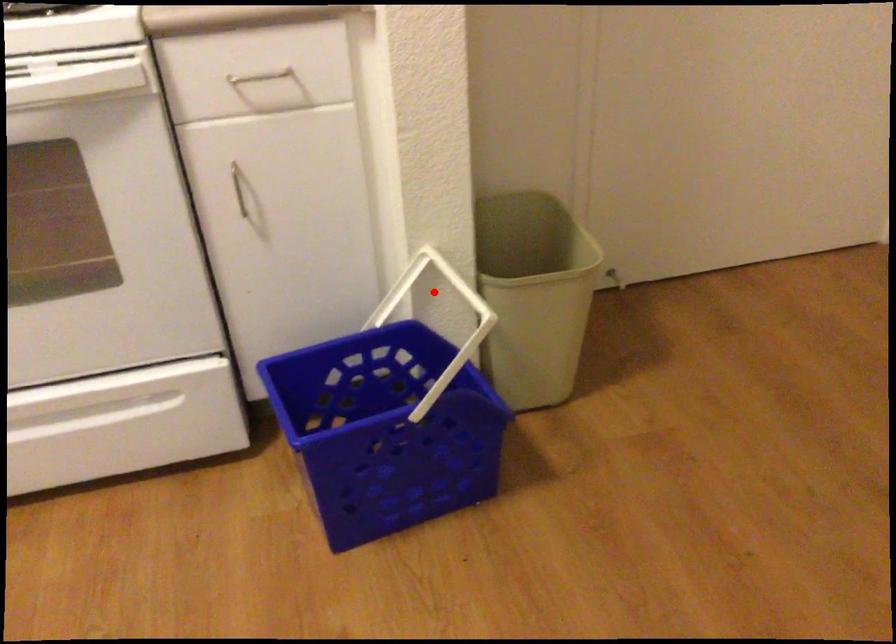
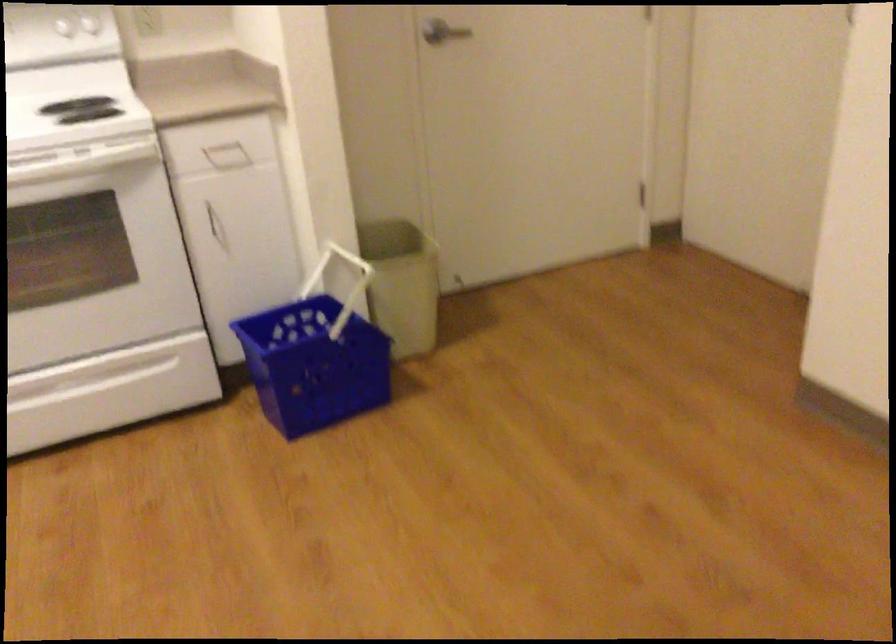
Question: A red point is marked in image1. In image2, is the corresponding 3D point closer to the camera or farther? Reply with the corresponding letter.

Choices:
 (A) The corresponding 3D point is closer.
 (B) The corresponding 3D point is farther.

Answer: (B)